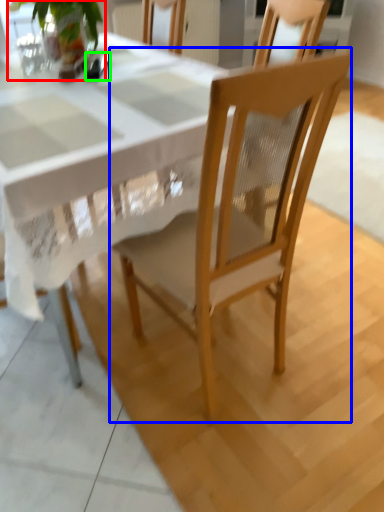
Question: Which object is the farthest from houseplant (highlighted by a red box)? Choose among these: chair (highlighted by a blue box) or tableware (highlighted by a green box).

Choices:
 (A) chair
 (B) tableware

Answer: (A)